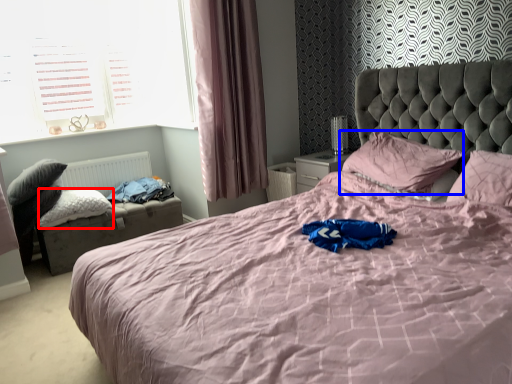
Question: Which of the following is the closest to the observer, pillow (highlighted by a red box) or pillow (highlighted by a blue box)?

Choices:
 (A) pillow
 (B) pillow

Answer: (B)